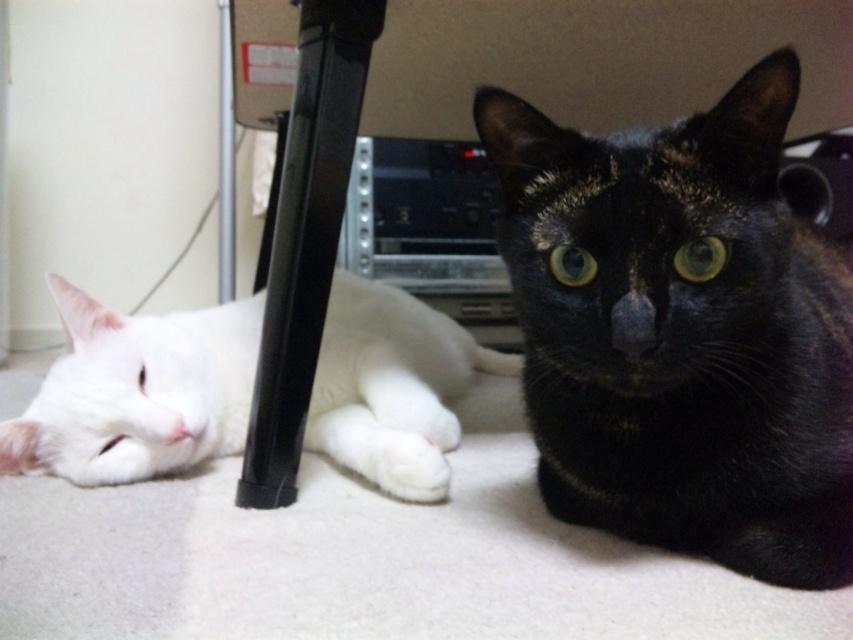
Can you confirm if black glossy cat at center is positioned below white fluffy cat at left?

Actually, black glossy cat at center is above white fluffy cat at left.

Is black glossy cat at center taller than white fluffy cat at left?

Correct, black glossy cat at center is much taller as white fluffy cat at left.

Looking at this image, measure the distance between black glossy cat at center and camera.

A distance of 25.14 inches exists between black glossy cat at center and camera.

The height and width of the screenshot is (640, 853). Find the location of `black glossy cat at center`. black glossy cat at center is located at coordinates (682, 332).